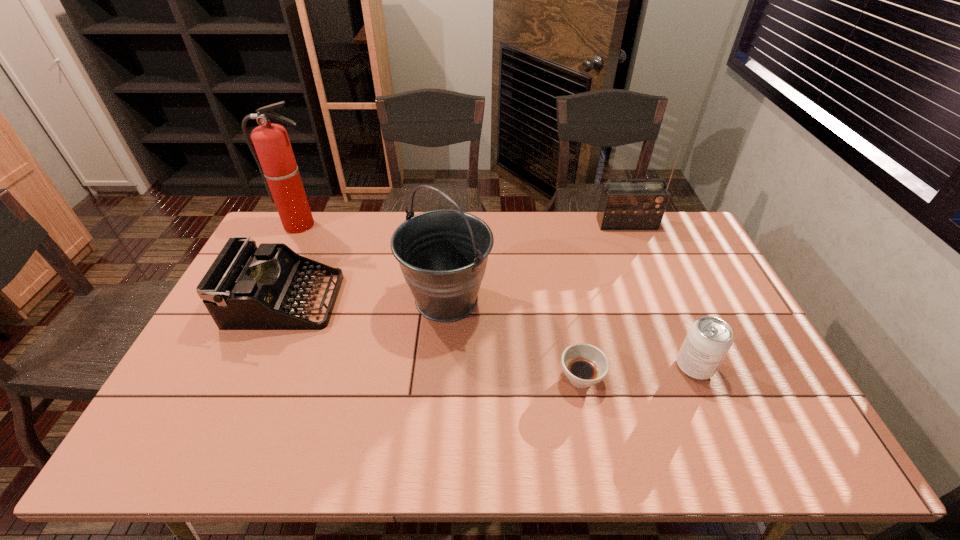
Find the location of a particular element. The width and height of the screenshot is (960, 540). free point between the radio receiver and the bucket is located at coordinates (537, 261).

Locate an element on the screen. The width and height of the screenshot is (960, 540). free space between the third object from right to left and the third tallest object is located at coordinates (604, 301).

At what (x,y) coordinates should I click in order to perform the action: click on unoccupied area between the soda can and the fourth object from right to left. Please return your answer as a coordinate pair (x, y). The width and height of the screenshot is (960, 540). Looking at the image, I should click on (570, 333).

Find the location of a particular element. vacant space in between the soda can and the tallest object is located at coordinates (497, 296).

Identify the location of vacant space in between the radio receiver and the soda can. (660, 295).

Locate an element on the screen. vacant space that is in between the soda can and the typewriter is located at coordinates (490, 334).

At what (x,y) coordinates should I click in order to perform the action: click on object that can be found as the closest to the shortest object. Please return your answer as a coordinate pair (x, y). The image size is (960, 540). Looking at the image, I should click on (443, 254).

This screenshot has width=960, height=540. In order to click on object that is the third closest one to the soda can in this screenshot , I will do `click(623, 205)`.

The image size is (960, 540). In order to click on vacant space that satisfies the following two spatial constraints: 1. with the nozzle and gauge on the third object from right to left; 2. on the left side of the fire extinguisher in this screenshot , I will do coord(225,378).

Where is `vacant space that satisfies the following two spatial constraints: 1. with the nozzle and gauge on the fire extinguisher; 2. on the left side of the fifth shortest object`? This screenshot has width=960, height=540. vacant space that satisfies the following two spatial constraints: 1. with the nozzle and gauge on the fire extinguisher; 2. on the left side of the fifth shortest object is located at coordinates (264, 299).